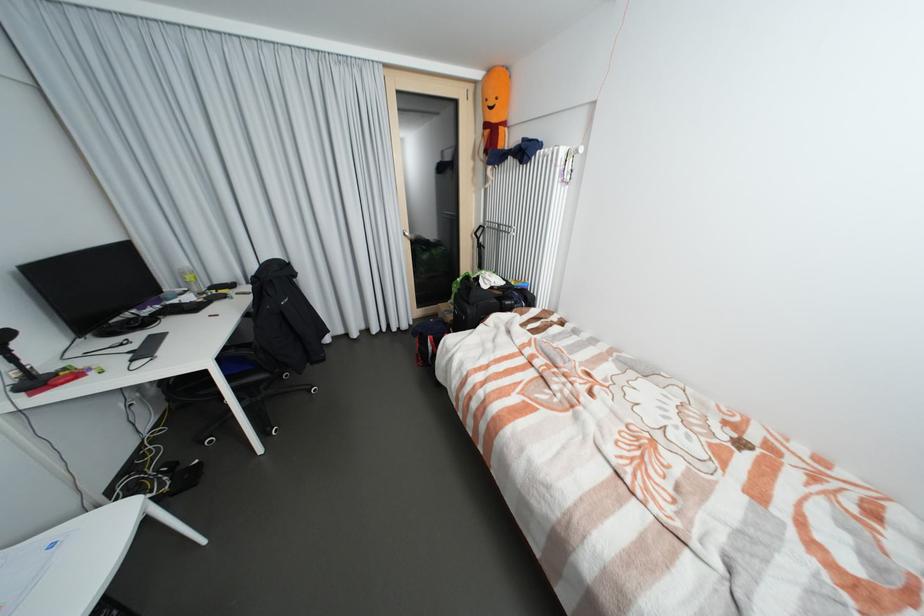
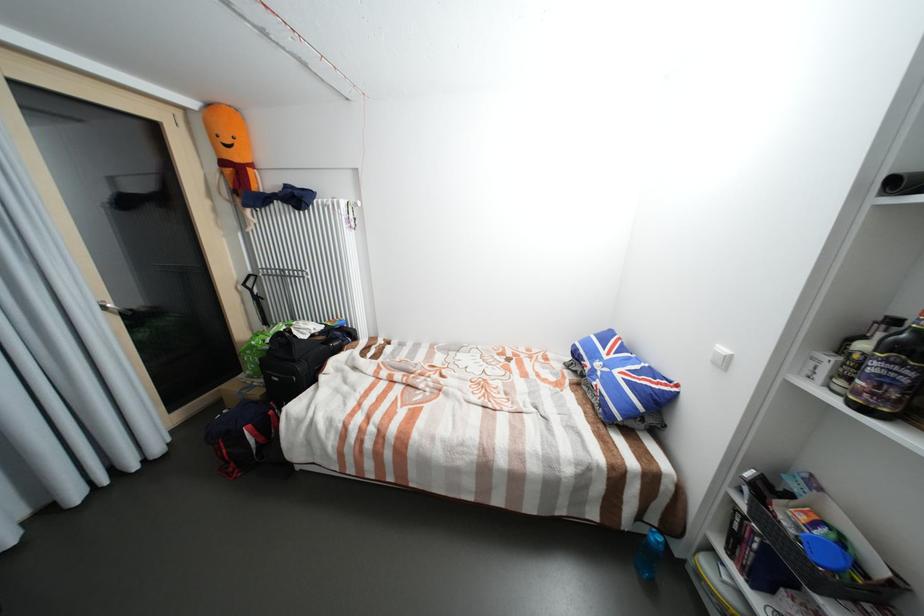
In the second image, find the point that corresponds to [495,281] in the first image.

(313, 330)